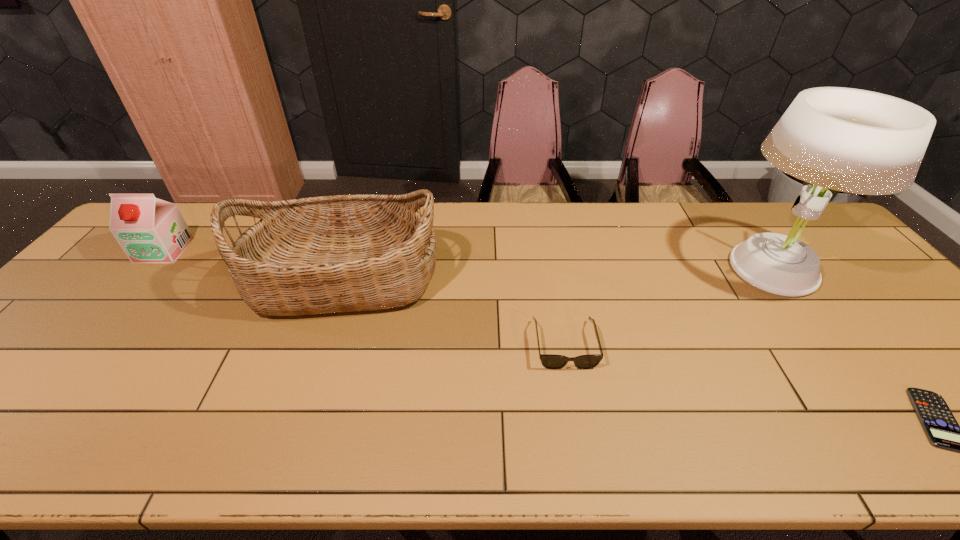
You are a GUI agent. You are given a task and a screenshot of the screen. Output one action in this format:
    pyautogui.click(x=<x>, y=<y>)
    Task: Click on the lamp
    This screenshot has height=540, width=960.
    Given the screenshot: What is the action you would take?
    pyautogui.click(x=851, y=140)

Locate an element on the screen. The width and height of the screenshot is (960, 540). basket is located at coordinates click(344, 253).

This screenshot has height=540, width=960. I want to click on the fourth shortest object, so click(344, 253).

The image size is (960, 540). What are the coordinates of `the leftmost object` in the screenshot? It's located at (149, 230).

Find the location of a particular element. the third tallest object is located at coordinates (149, 230).

Where is `the fourth tallest object`? Image resolution: width=960 pixels, height=540 pixels. the fourth tallest object is located at coordinates (550, 361).

This screenshot has width=960, height=540. In order to click on sunglasses in this screenshot , I will do `click(550, 361)`.

You are a GUI agent. You are given a task and a screenshot of the screen. Output one action in this format:
    pyautogui.click(x=<x>, y=<y>)
    Task: Click on the free space located on the front-facing side of the lamp
    Image resolution: width=960 pixels, height=540 pixels.
    Given the screenshot: What is the action you would take?
    pyautogui.click(x=892, y=433)

The width and height of the screenshot is (960, 540). What are the coordinates of `vacant space located on the front of the second object from left to right` in the screenshot? It's located at (316, 367).

This screenshot has height=540, width=960. What are the coordinates of `free space located with the cap open on the leftmost object` in the screenshot? It's located at (57, 376).